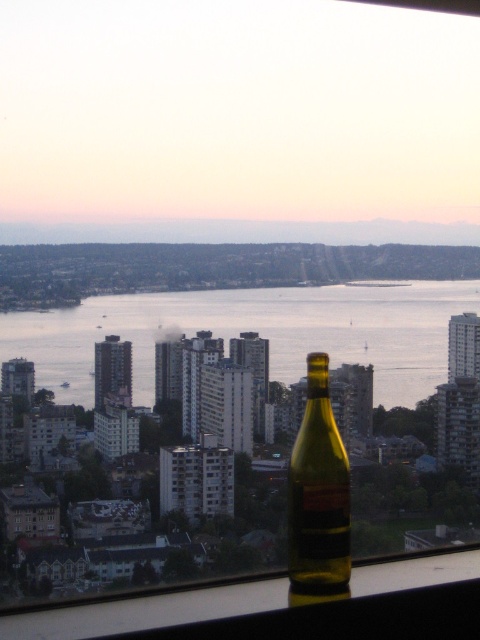
Question: Does transparent glass water at center have a lesser width compared to transparent glass window sill at lower center?

Choices:
 (A) no
 (B) yes

Answer: (B)

Question: Which of the following is the farthest from the observer?

Choices:
 (A) (232, 618)
 (B) (39, 339)

Answer: (A)

Question: Is the position of transparent glass water at center more distant than that of matte glass bottle at center?

Choices:
 (A) no
 (B) yes

Answer: (A)

Question: Can you confirm if transparent glass water at center is positioned to the right of transparent glass window sill at lower center?

Choices:
 (A) no
 (B) yes

Answer: (A)

Question: Which is nearer to the transparent glass window sill at lower center?

Choices:
 (A) matte glass bottle at center
 (B) transparent glass water at center

Answer: (A)

Question: Which point is farther to the camera?

Choices:
 (A) (260, 634)
 (B) (170, 324)
 (C) (324, 458)

Answer: (A)